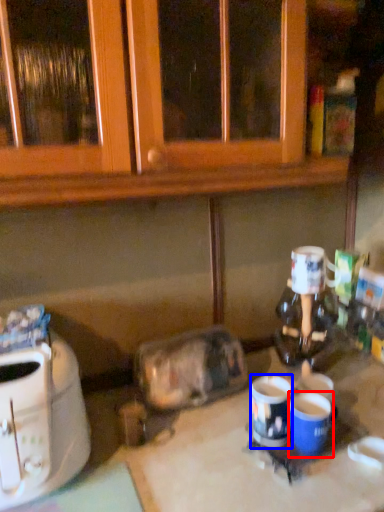
Question: Among these objects, which one is nearest to the camera, coffee cup (highlighted by a red box) or coffee cup (highlighted by a blue box)?

Choices:
 (A) coffee cup
 (B) coffee cup

Answer: (A)